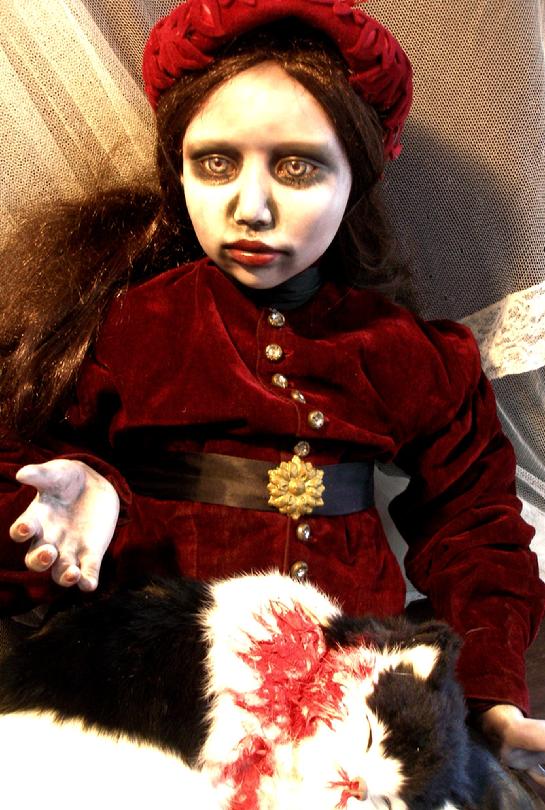
Image resolution: width=545 pixels, height=810 pixels. Find the location of `wall`. wall is located at coordinates (77, 112), (462, 177).